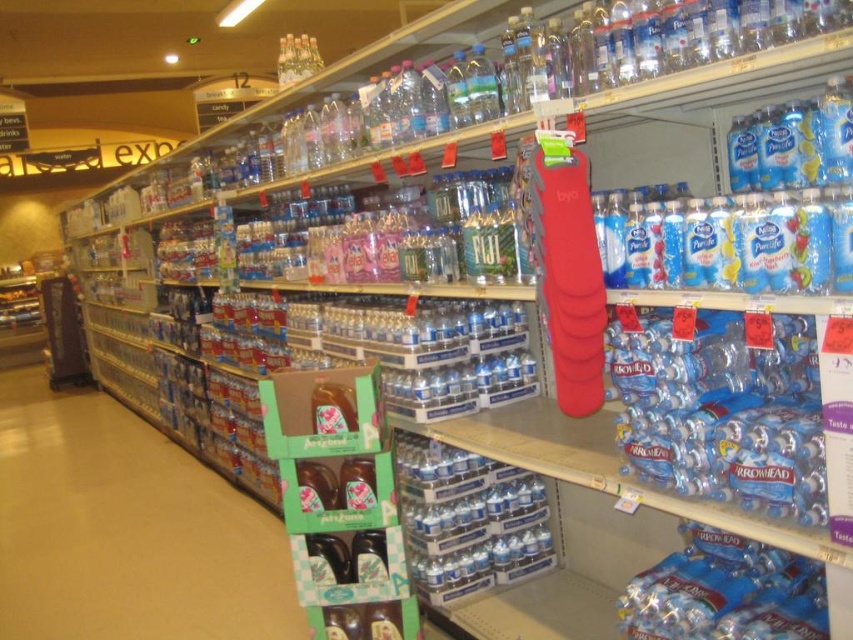
Which is more to the right, translucent plastic water bottle at center or clear glass bottles at upper center?

Positioned to the right is translucent plastic water bottle at center.

Who is taller, translucent plastic water bottle at center or clear glass bottles at upper center?

translucent plastic water bottle at center

This screenshot has height=640, width=853. In order to click on translucent plastic water bottle at center in this screenshot , I will do `click(721, 408)`.

Can you confirm if green cardboard box at lower left is positioned to the left of clear glass bottles at upper center?

Correct, you'll find green cardboard box at lower left to the left of clear glass bottles at upper center.

I want to click on green cardboard box at lower left, so click(x=126, y=531).

Can you confirm if green cardboard box at lower left is wider than translucent plastic water bottle at center?

Yes, green cardboard box at lower left is wider than translucent plastic water bottle at center.

Can you confirm if green cardboard box at lower left is positioned to the left of translucent plastic water bottle at center?

Correct, you'll find green cardboard box at lower left to the left of translucent plastic water bottle at center.

Between point (100, 468) and point (787, 339), which one is positioned in front?

Positioned in front is point (787, 339).

The image size is (853, 640). I want to click on green cardboard box at lower left, so [x=126, y=531].